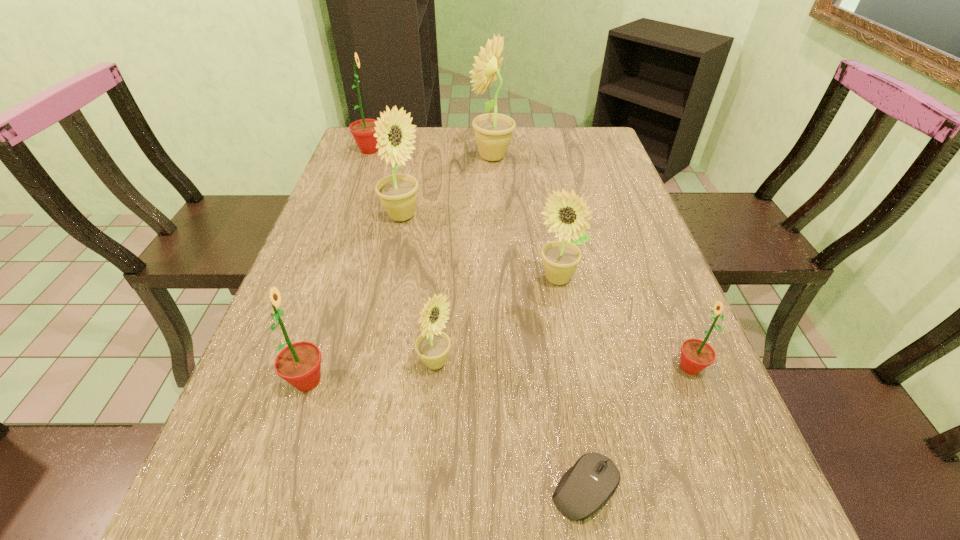
Image resolution: width=960 pixels, height=540 pixels. Find the location of `the second yellow sunflower from right to left`. the second yellow sunflower from right to left is located at coordinates (493, 132).

You are a GUI agent. You are given a task and a screenshot of the screen. Output one action in this format:
    pyautogui.click(x=<x>, y=<y>)
    Task: Click on the fifth object from left to right
    
    Given the screenshot: What is the action you would take?
    (493, 132)

At what (x,y) coordinates should I click in order to perform the action: click on the third nearest yellow sunflower. Please return your answer as a coordinate pair (x, y). The height and width of the screenshot is (540, 960). Looking at the image, I should click on (398, 192).

You are a GUI agent. You are given a task and a screenshot of the screen. Output one action in this format:
    pyautogui.click(x=<x>, y=<y>)
    Task: Click on the third farthest sunflower
    This screenshot has height=540, width=960.
    Given the screenshot: What is the action you would take?
    pyautogui.click(x=398, y=192)

Find the location of `the farthest green sunflower`. the farthest green sunflower is located at coordinates (363, 131).

The height and width of the screenshot is (540, 960). Identify the location of the second biggest green sunflower. (299, 364).

You are a GUI agent. You are given a task and a screenshot of the screen. Output one action in this format:
    pyautogui.click(x=<x>, y=<y>)
    Task: Click on the rightmost yellow sunflower
    The width and height of the screenshot is (960, 540).
    Given the screenshot: What is the action you would take?
    pyautogui.click(x=567, y=215)

Where is `the second smallest yellow sunflower`? This screenshot has height=540, width=960. the second smallest yellow sunflower is located at coordinates (567, 215).

At what (x,y) coordinates should I click in order to perform the action: click on the smallest yellow sunflower. Please return your answer as a coordinate pair (x, y). Looking at the image, I should click on (432, 346).

Locate an element on the screen. This screenshot has height=540, width=960. the third yellow sunflower from right to left is located at coordinates (432, 346).